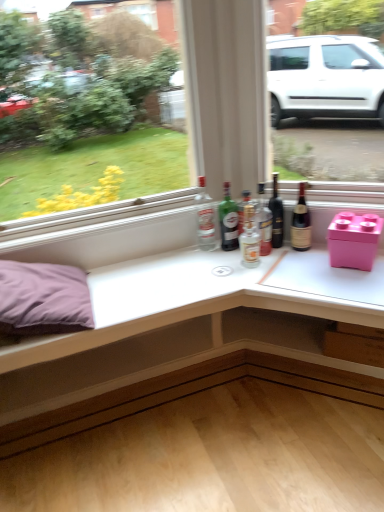
This screenshot has width=384, height=512. What are the coordinates of `free space between dark glass bottle at center and pink plastic storage box at right` in the screenshot? It's located at (302, 254).